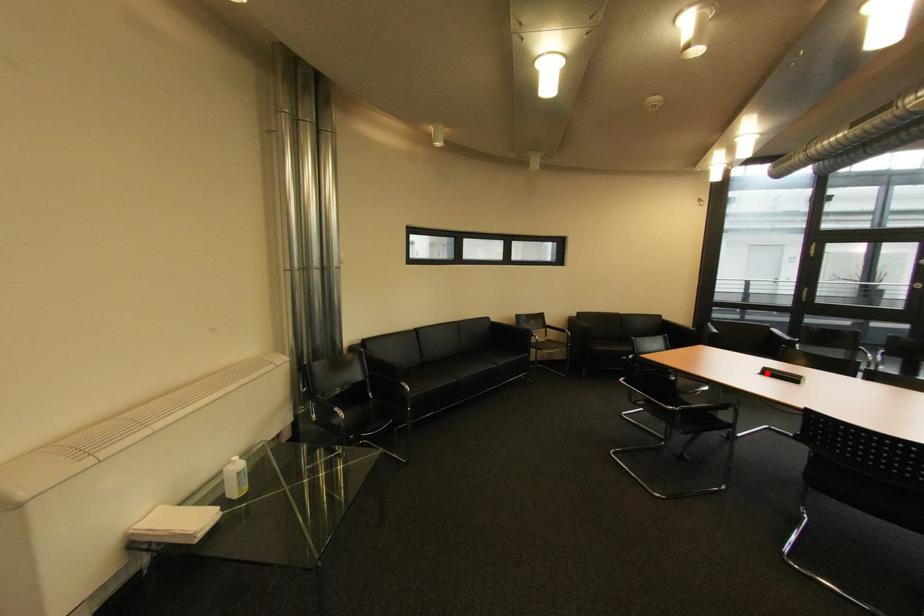
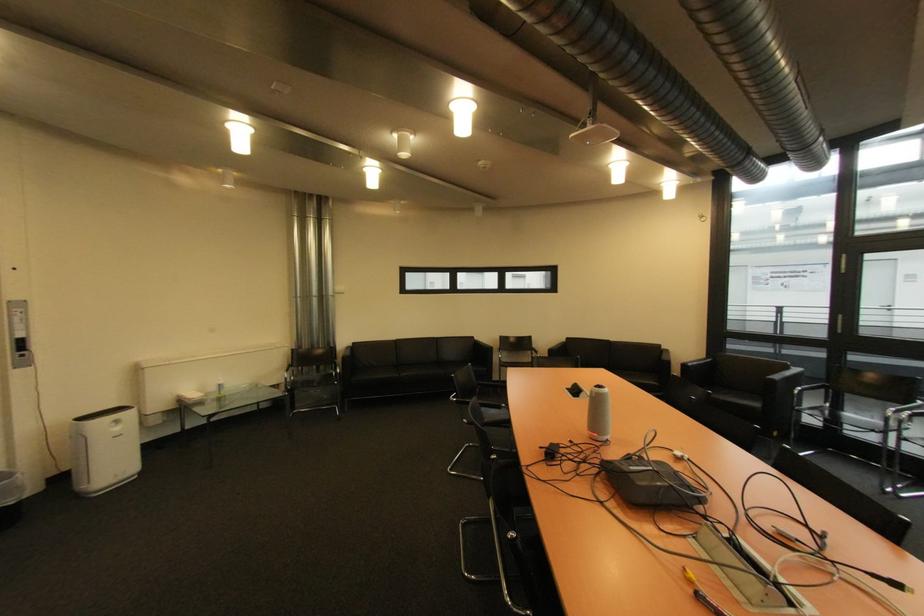
The point at the highlighted location is marked in the first image. Where is the corresponding point in the second image?

(578, 389)